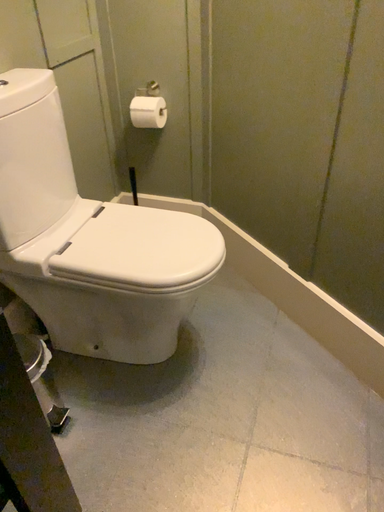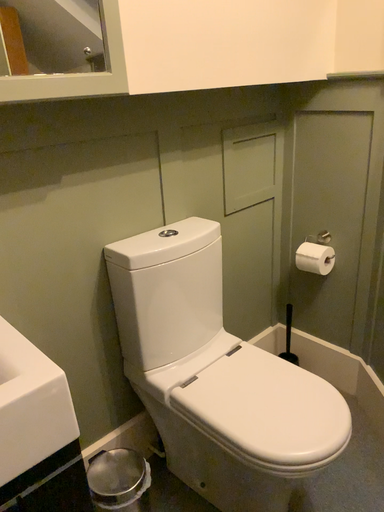
Question: Which way did the camera rotate in the video?

Choices:
 (A) rotated upward
 (B) rotated downward

Answer: (A)